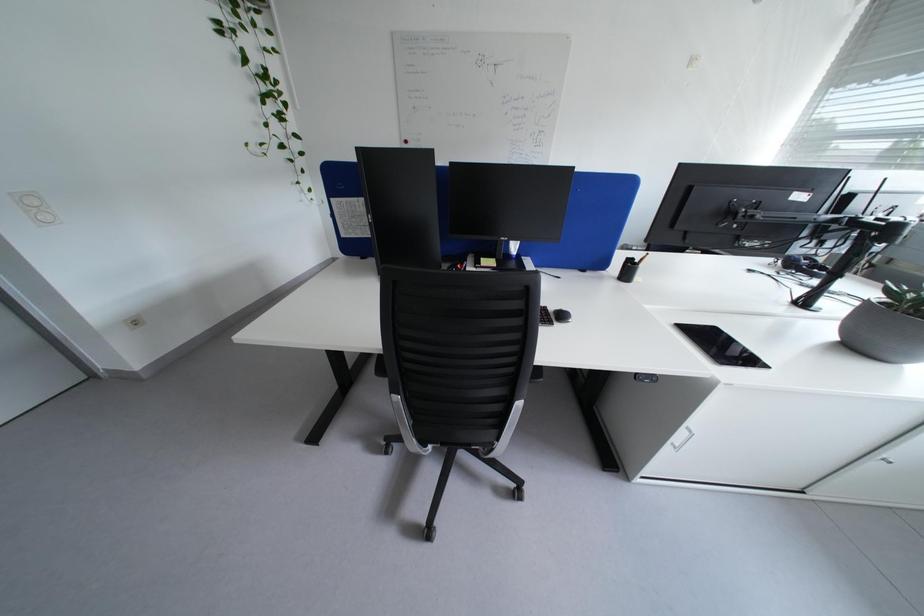
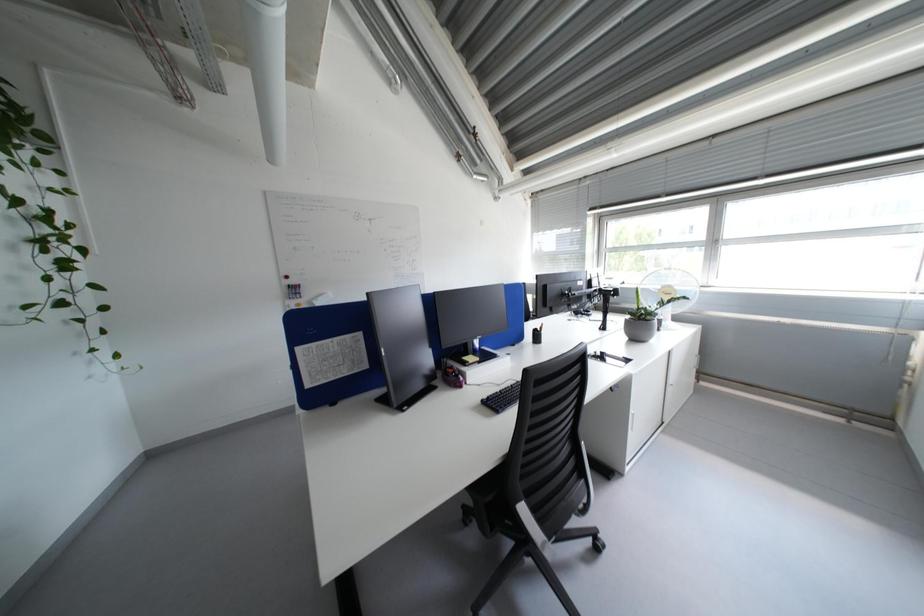
Question: The camera is either moving clockwise (left) or counter-clockwise (right) around the object. The first image is from the beginning of the video and the second image is from the end. Is the camera moving left or right when shooting the video?

Choices:
 (A) Left
 (B) Right

Answer: (A)